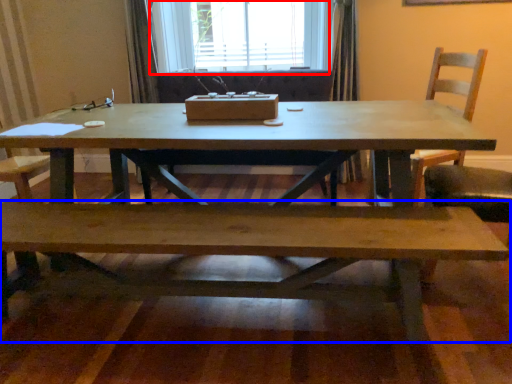
Question: Among these objects, which one is nearest to the camera, window (highlighted by a red box) or bench (highlighted by a blue box)?

Choices:
 (A) window
 (B) bench

Answer: (B)